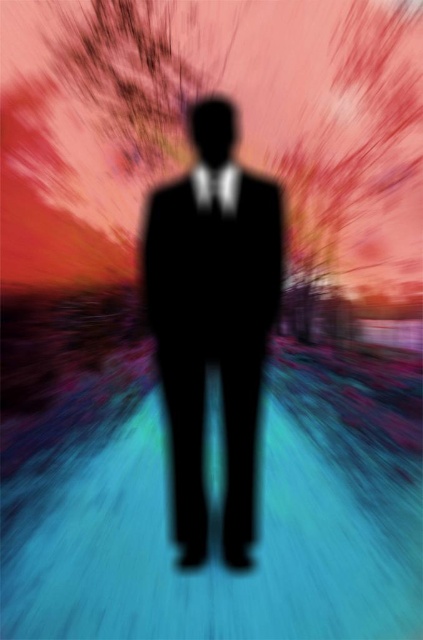
You are a fashion designer observing the silhouette of a person wearing a black matte suit at center and a matte black tie at center. Which clothing item is taller?

The black matte suit at center is taller than the matte black tie at center.